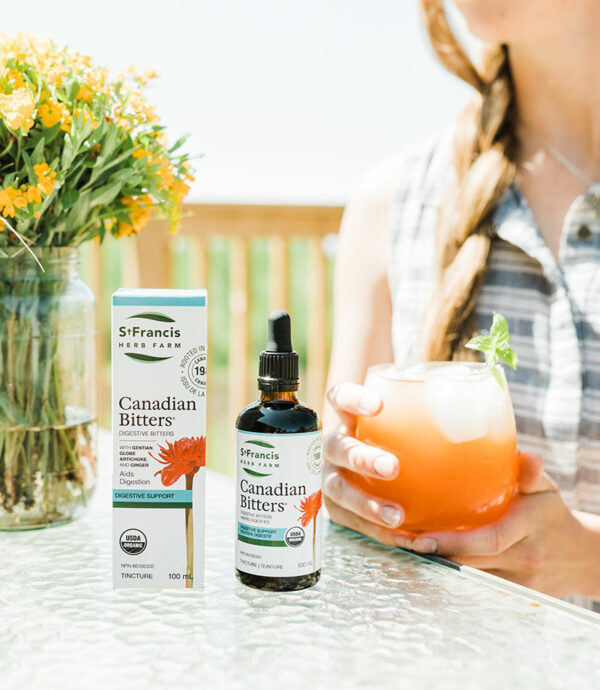
Where is `vase`? The width and height of the screenshot is (600, 690). vase is located at coordinates (86, 357).